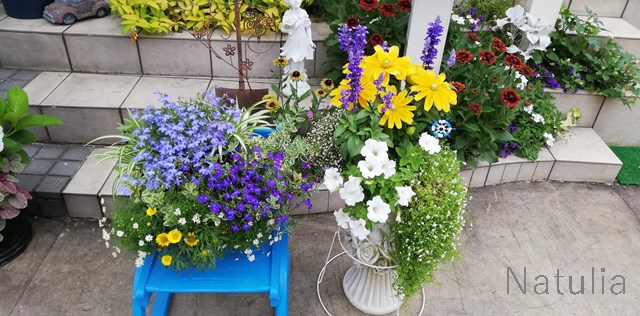
This screenshot has width=640, height=316. I want to click on white statue of person, so click(299, 32).